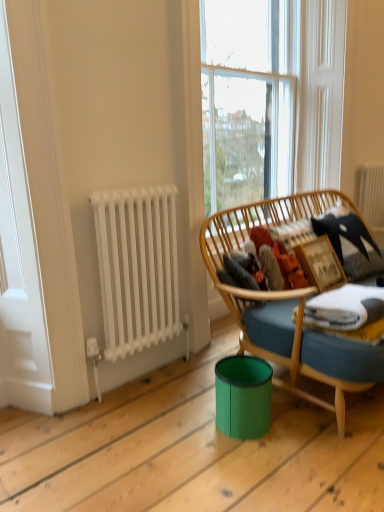
Image resolution: width=384 pixels, height=512 pixels. Describe the element at coordinates (19, 261) in the screenshot. I see `white matte radiator at left` at that location.

The width and height of the screenshot is (384, 512). I want to click on green plastic trash bin at lower center, so click(x=243, y=396).

The image size is (384, 512). What are the coordinates of `wooden picture frame at right` in the screenshot? It's located at 320,264.

Image resolution: width=384 pixels, height=512 pixels. What do you see at coordinates (271, 98) in the screenshot? I see `clear glass window at upper center` at bounding box center [271, 98].

Measure the distance between point (165, 329) and camera.

Point (165, 329) and camera are 6.74 feet apart from each other.

Where is `fuzzy fabric at center`? This screenshot has height=512, width=384. fuzzy fabric at center is located at coordinates (263, 266).

Who is bigger, wooden picture frame at right or white matte radiator at left?

With larger size is white matte radiator at left.

Where is `screen door located on the left of wooden picture frame at right`? screen door located on the left of wooden picture frame at right is located at coordinates (19, 261).

Can you confirm if wooden picture frame at right is taller than white matte radiator at left?

Incorrect, the height of wooden picture frame at right is not larger of that of white matte radiator at left.

Considering the positions of point (284, 92) and point (291, 260), is point (284, 92) closer or farther from the camera than point (291, 260)?

Point (284, 92) appears to be farther away from the viewer than point (291, 260).

From the image's perspective, relative to fuzzy fabric at center, is clear glass window at upper center above or below?

From the image's perspective, clear glass window at upper center appears above fuzzy fabric at center.

From a real-world perspective, is clear glass window at upper center on top of fuzzy fabric at center?

Yes, from a real-world perspective, clear glass window at upper center is above fuzzy fabric at center.

Based on the photo, visually, is clear glass window at upper center positioned to the left or to the right of fuzzy fabric at center?

Clearly, clear glass window at upper center is on the right of fuzzy fabric at center in the image.

Who is bigger, white metallic radiator at left, marked as the 1th radiator in a front-to-back arrangement, or white metal radiator at upper right, the 2th radiator ordered from the bottom?

With larger size is white metallic radiator at left, marked as the 1th radiator in a front-to-back arrangement.

Which object is wider, white metallic radiator at left, marked as the 1th radiator in a front-to-back arrangement, or white metal radiator at upper right, the 2th radiator viewed from the front?

white metallic radiator at left, marked as the 1th radiator in a front-to-back arrangement, is wider.

Is point (150, 187) positioned before point (378, 206)?

Yes.

Measure the distance from clear glass window at upper center to white matte radiator at left.

4.98 feet.

Does clear glass window at upper center appear on the left side of white matte radiator at left?

In fact, clear glass window at upper center is to the right of white matte radiator at left.

Considering the relative positions of clear glass window at upper center and white matte radiator at left in the image provided, is clear glass window at upper center behind white matte radiator at left?

That is True.

Is clear glass window at upper center far away from white matte radiator at left?

clear glass window at upper center is far away from white matte radiator at left.

From a real-world perspective, is green plastic trash bin at lower center above or below fuzzy fabric at center?

green plastic trash bin at lower center is situated lower than fuzzy fabric at center in the real world.

Does green plastic trash bin at lower center have a lesser width compared to fuzzy fabric at center?

No.

Is green plastic trash bin at lower center placed right next to fuzzy fabric at center?

There is a gap between green plastic trash bin at lower center and fuzzy fabric at center.

Is green plastic trash bin at lower center located outside fuzzy fabric at center?

Indeed, green plastic trash bin at lower center is completely outside fuzzy fabric at center.

Considering the relative positions of white matte radiator at left and wooden picture frame at right in the image provided, is white matte radiator at left to the right of wooden picture frame at right from the viewer's perspective?

Incorrect, white matte radiator at left is not on the right side of wooden picture frame at right.

Would you say white matte radiator at left is a long distance from wooden picture frame at right?

That's right, there is a large distance between white matte radiator at left and wooden picture frame at right.

Considering the relative sizes of white matte radiator at left and wooden picture frame at right in the image provided, is white matte radiator at left shorter than wooden picture frame at right?

In fact, white matte radiator at left may be taller than wooden picture frame at right.

You are a GUI agent. You are given a task and a screenshot of the screen. Output one action in this format:
    pyautogui.click(x=<x>, y=<y>)
    Task: Click on the radiator behind the wooden picture frame at right
    The image size is (384, 512).
    Given the screenshot: What is the action you would take?
    pyautogui.click(x=372, y=200)

Does point (362, 199) appear closer or farther from the camera than point (306, 275)?

Point (362, 199).

Based on the photo, which object is further away from the camera, white metal radiator at upper right, arranged as the first radiator when viewed from the back, or wooden picture frame at right?

white metal radiator at upper right, arranged as the first radiator when viewed from the back.

Can you confirm if white metal radiator at upper right, the 2th radiator viewed from the front, is smaller than wooden picture frame at right?

Actually, white metal radiator at upper right, the 2th radiator viewed from the front, might be larger than wooden picture frame at right.

The image size is (384, 512). Find the location of `screen door that appears above the wooden picture frame at right (from the image's perspective)`. screen door that appears above the wooden picture frame at right (from the image's perspective) is located at coordinates (19, 261).

The image size is (384, 512). What are the coordinates of `clothing below the clear glass window at upper center (from a real-world perspective)` in the screenshot? It's located at (263, 266).

Which object lies further to the anchor point white metal radiator at upper right, the 2th radiator ordered from the bottom, wooden picture frame at right or white metallic radiator at left, arranged as the second radiator when viewed from the back?

white metallic radiator at left, arranged as the second radiator when viewed from the back, is positioned further to the anchor white metal radiator at upper right, the 2th radiator ordered from the bottom.

Looking at the image, which one is located further to green plastic trash bin at lower center, wooden picture frame at right or white matte radiator at left?

white matte radiator at left.

Based on their spatial positions, is clear glass window at upper center or white matte radiator at left further from wooden picture frame at right?

Based on the image, white matte radiator at left appears to be further to wooden picture frame at right.

Based on their spatial positions, is green plastic trash bin at lower center or white metal radiator at upper right, the 2th radiator viewed from the front, closer to clear glass window at upper center?

white metal radiator at upper right, the 2th radiator viewed from the front.

From the image, which object appears to be nearer to clear glass window at upper center, fuzzy fabric at center or white metallic radiator at left, placed as the 1th radiator when sorted from bottom to top?

The object closer to clear glass window at upper center is fuzzy fabric at center.

Which object lies further to the anchor point wooden picture frame at right, white metal radiator at upper right, the 2th radiator ordered from the bottom, or green plastic trash bin at lower center?

white metal radiator at upper right, the 2th radiator ordered from the bottom, is positioned further to the anchor wooden picture frame at right.

From the image, which object appears to be farther from white matte radiator at left, clear glass window at upper center or fuzzy fabric at center?

Among the two, clear glass window at upper center is located further to white matte radiator at left.

When comparing their distances from fuzzy fabric at center, does white matte radiator at left or clear glass window at upper center seem closer?

The object closer to fuzzy fabric at center is clear glass window at upper center.

This screenshot has height=512, width=384. In order to click on picture frame between green plastic trash bin at lower center and white metal radiator at upper right, which appears as the 2th radiator when viewed from the left, along the z-axis in this screenshot , I will do `click(320, 264)`.

The width and height of the screenshot is (384, 512). Identify the location of clothing between clear glass window at upper center and white metal radiator at upper right, the 2th radiator ordered from the bottom, along the z-axis. (263, 266).

This screenshot has height=512, width=384. Identify the location of clothing between white matte radiator at left and white metal radiator at upper right, which ranks as the 1th radiator in right-to-left order, from left to right. (263, 266).

You are a GUI agent. You are given a task and a screenshot of the screen. Output one action in this format:
    pyautogui.click(x=<x>, y=<y>)
    Task: Click on the clothing between white matte radiator at left and clear glass window at upper center from left to right
    The image size is (384, 512).
    Given the screenshot: What is the action you would take?
    (x=263, y=266)